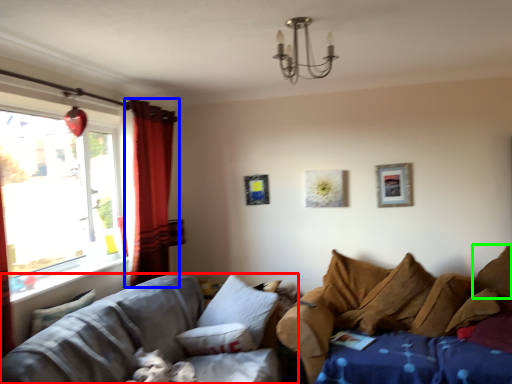
Question: Estimate the real-world distances between objects in this image. Which object is farther from studio couch (highlighted by a red box), curtain (highlighted by a blue box) or pillow (highlighted by a green box)?

Choices:
 (A) curtain
 (B) pillow

Answer: (B)